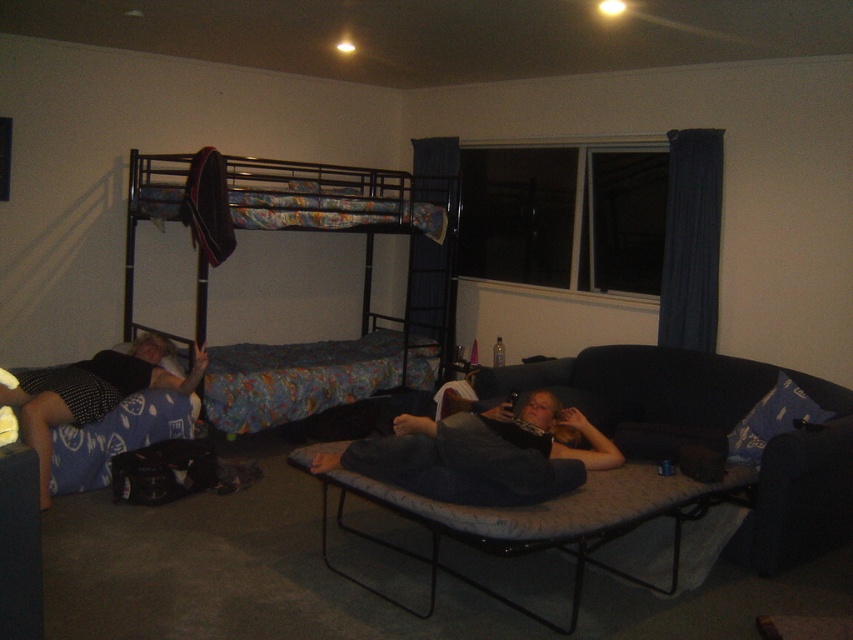
Is dark fabric couch at lower right positioned before blue fabric pillow at lower right?

Yes, it is.

Does dark fabric couch at lower right have a lesser width compared to blue fabric pillow at lower right?

In fact, dark fabric couch at lower right might be wider than blue fabric pillow at lower right.

This screenshot has width=853, height=640. What do you see at coordinates (709, 433) in the screenshot?
I see `dark fabric couch at lower right` at bounding box center [709, 433].

I want to click on dark fabric couch at lower right, so click(709, 433).

This screenshot has height=640, width=853. What are the coordinates of `dark fabric couch at lower right` in the screenshot? It's located at (x=709, y=433).

Does dark fabric couch at lower right have a larger size compared to gray fabric couch at lower right?

Yes.

Does point (643, 401) come closer to viewer compared to point (531, 401)?

No.

Where is `dark fabric couch at lower right`? The image size is (853, 640). dark fabric couch at lower right is located at coordinates (709, 433).

Which is behind, point (229, 433) or point (18, 410)?

The point (229, 433) is behind.

Which is in front, point (154, 160) or point (136, 392)?

Point (136, 392) is more forward.

The height and width of the screenshot is (640, 853). I want to click on metallic bunk bed at upper center, so click(x=363, y=292).